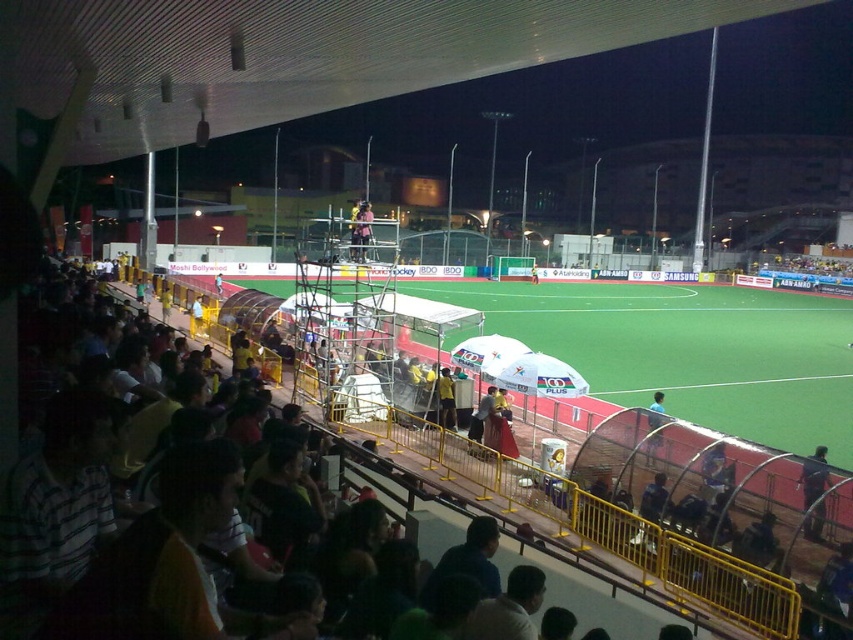
Question: Can you confirm if dark blue uniform at center is wider than matte pink shirt at center?

Choices:
 (A) no
 (B) yes

Answer: (B)

Question: Which object is the farthest from the matte pink shirt at center?

Choices:
 (A) green artificial turf at center
 (B) dark blue uniform at center

Answer: (A)

Question: Is green artificial turf at center further to the viewer compared to dark blue uniform at center?

Choices:
 (A) no
 (B) yes

Answer: (B)

Question: Does green artificial turf at center lie behind matte pink shirt at center?

Choices:
 (A) no
 (B) yes

Answer: (B)

Question: Which point is closer to the camera?

Choices:
 (A) green artificial turf at center
 (B) dark blue uniform at center

Answer: (B)

Question: Which point is closer to the camera taking this photo?

Choices:
 (A) (815, 524)
 (B) (683, 385)
 (C) (363, 252)

Answer: (A)